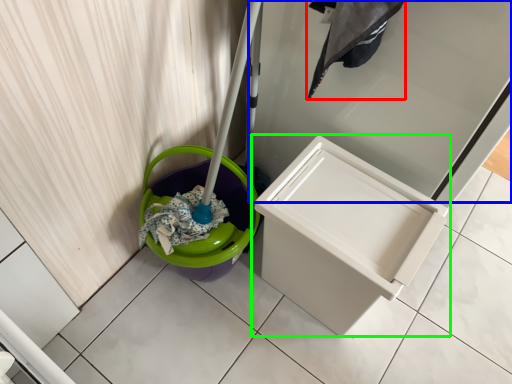
Question: Which is farther away from laundry (highlighted by a red box)? screen door (highlighted by a blue box) or waste container (highlighted by a green box)?

Choices:
 (A) screen door
 (B) waste container

Answer: (B)